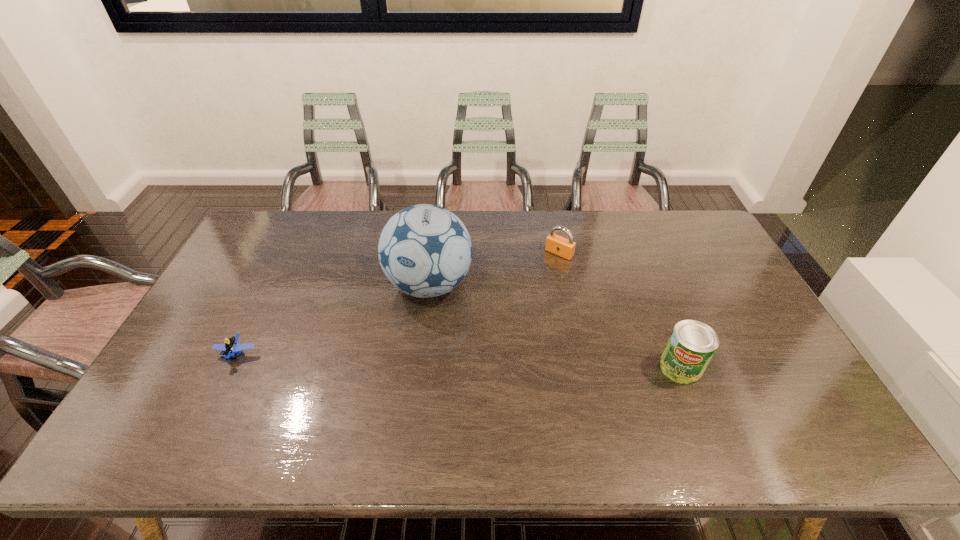
At what (x,y) coordinates should I click in order to perform the action: click on free space on the desktop that is between the Lego and the can and is positioned to unlock the second object from right to left from the front. Please return your answer as a coordinate pair (x, y). This screenshot has height=540, width=960. Looking at the image, I should click on (461, 361).

At what (x,y) coordinates should I click in order to perform the action: click on free space on the desktop that is between the leftmost object and the can and is positioned on the side with brand of the tallest object. Please return your answer as a coordinate pair (x, y). The width and height of the screenshot is (960, 540). Looking at the image, I should click on (411, 360).